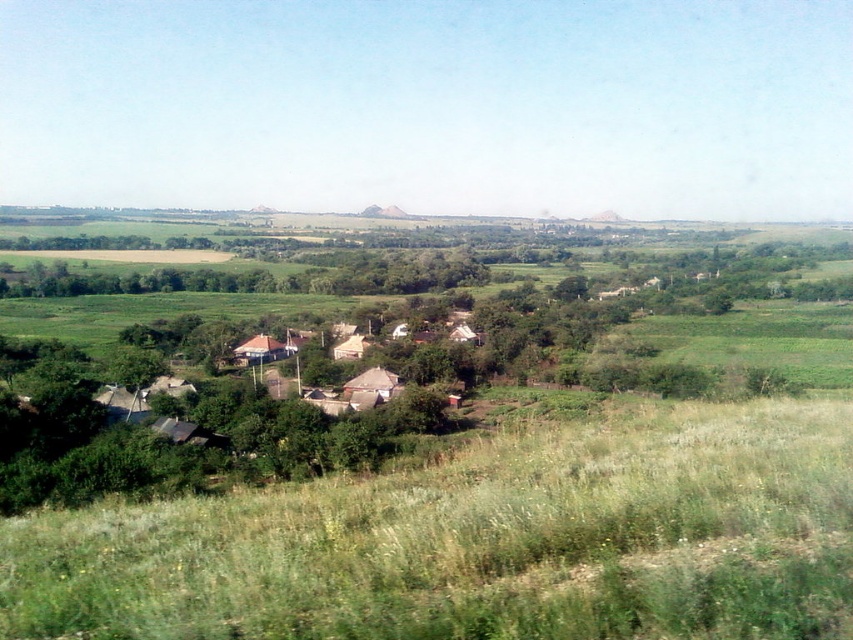
Does green grassy field at lower center appear under green grassy field at right?

Yes, green grassy field at lower center is below green grassy field at right.

Does green grassy field at lower center have a larger size compared to green grassy field at right?

Incorrect, green grassy field at lower center is not larger than green grassy field at right.

Does point (755, 444) come farther from viewer compared to point (669, 328)?

That is False.

Find the location of a particular element. green grassy field at lower center is located at coordinates (480, 541).